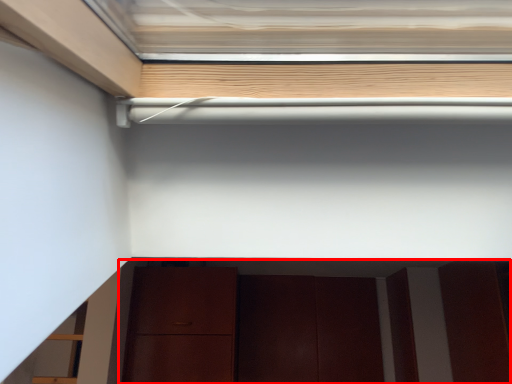
Question: From the image's perspective, what is the correct spatial positioning of cabinetry (annotated by the red box) in reference to door?

Choices:
 (A) above
 (B) below

Answer: (A)